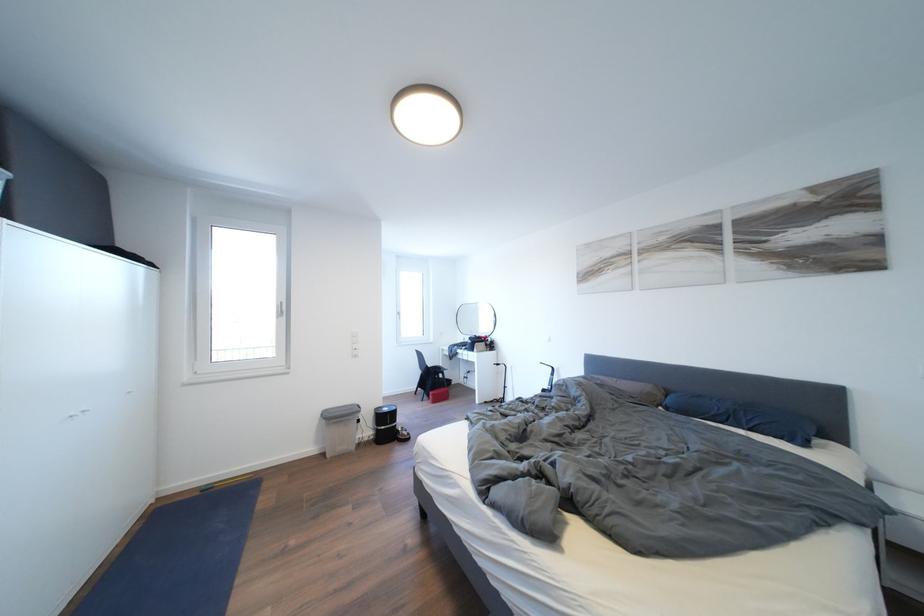
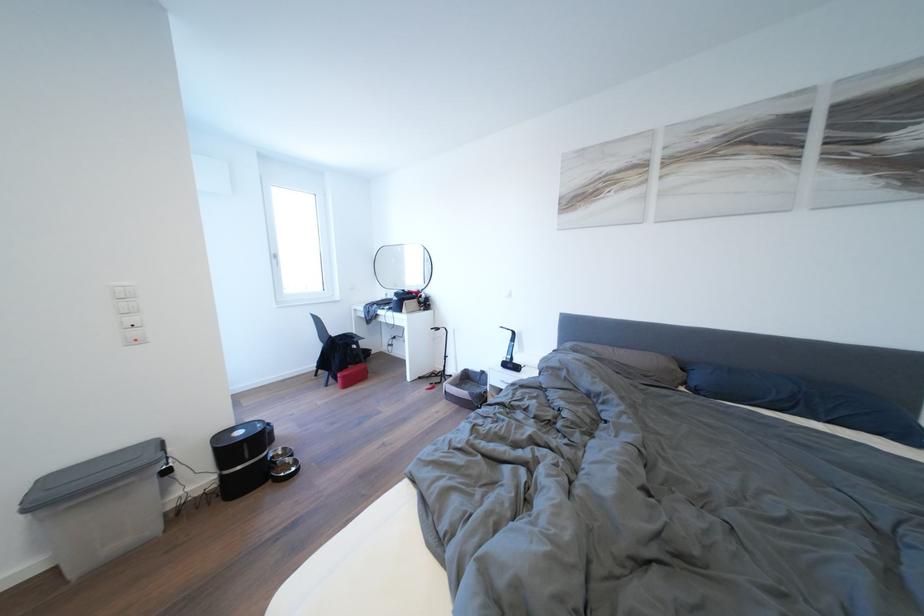
In the second image, find the point that corresponds to pixel 606 387 in the first image.

(602, 360)